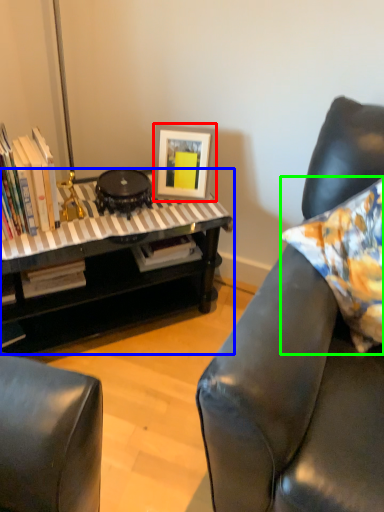
Question: Considering the real-world distances, which object is closest to picture frame (highlighted by a red box)? table (highlighted by a blue box) or pillow (highlighted by a green box).

Choices:
 (A) table
 (B) pillow

Answer: (A)